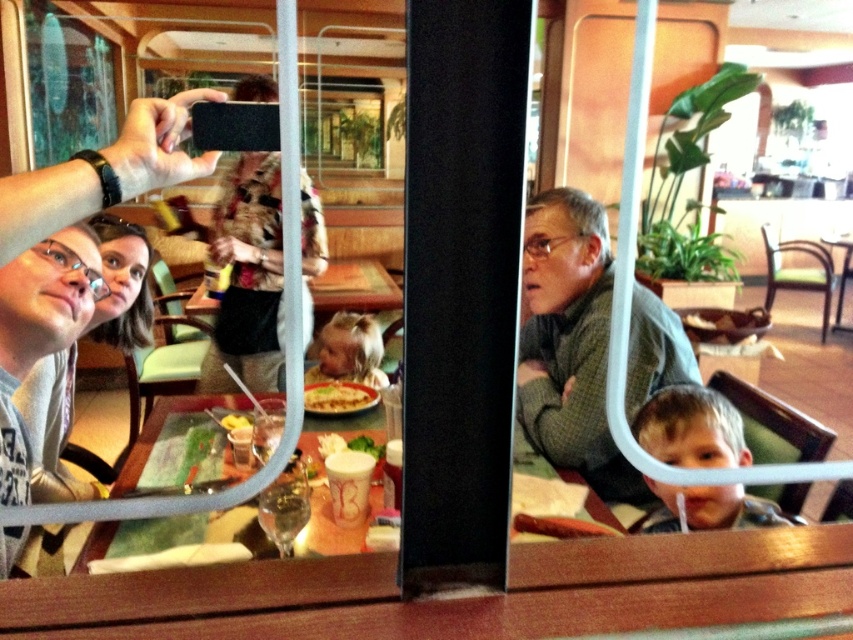
Consider the image. You are standing in the dining area and see two points reflected in the glass partition. The first point is at coordinates point (242,152) and the second is at point (705,392). Based on their positions in the reflection, which point is closer to you?

Point (705,392) is closer to you because in the reflection, objects further away from the glass appear behind those that are nearer. Since point (242,152) is behind point (705,392) in the reflection, it means the latter is closer to your position.

You are a food critic who just took a photo of the yellowish matte sandwich at center and the yellow cheese at center. Based on the reflection in the glass, which object appears higher in the photo?

The yellowish matte sandwich at center appears higher in the photo because it is positioned above the yellow cheese at center in the scene.